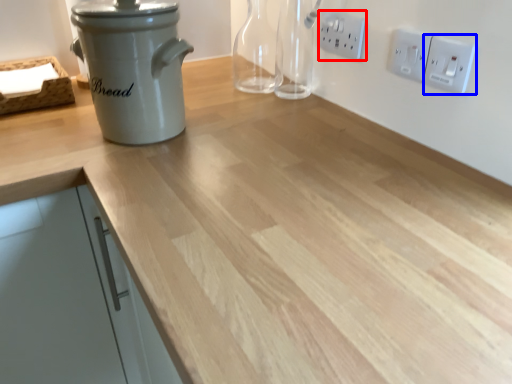
Question: Among these objects, which one is nearest to the camera, electric outlet (highlighted by a red box) or electric outlet (highlighted by a blue box)?

Choices:
 (A) electric outlet
 (B) electric outlet

Answer: (B)